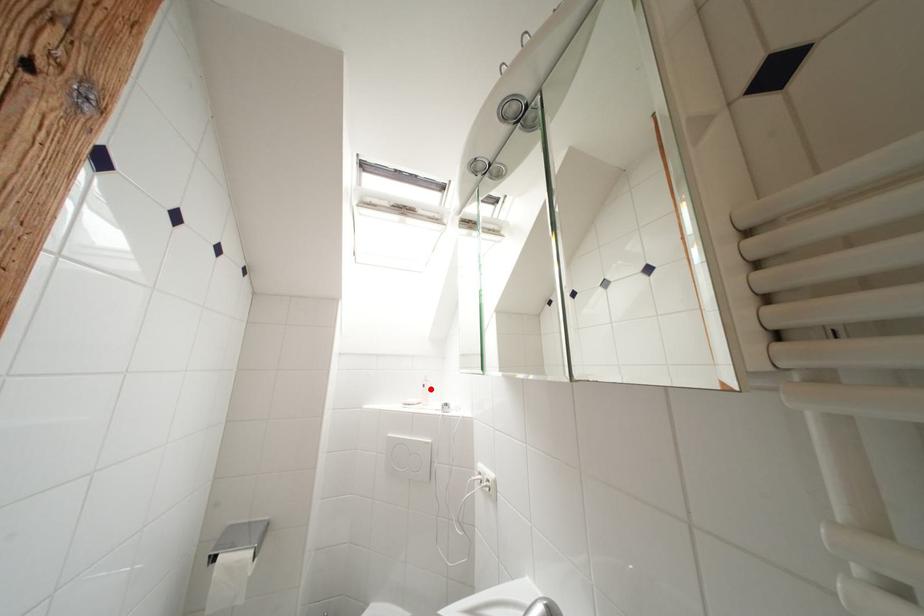
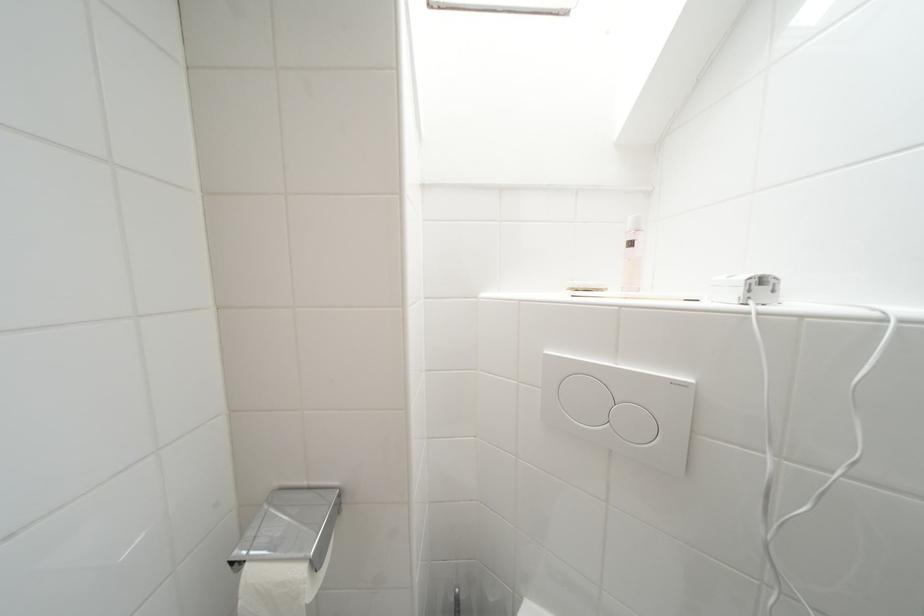
In the second image, find the point that corresponds to the highlighted location in the first image.

(638, 246)